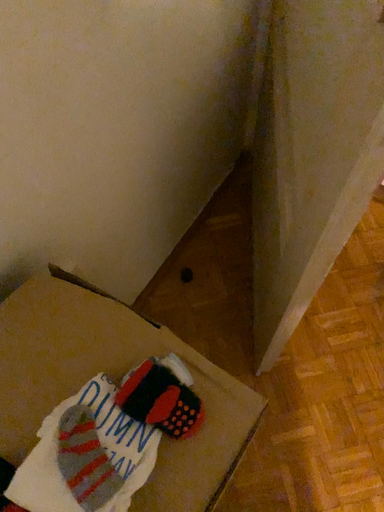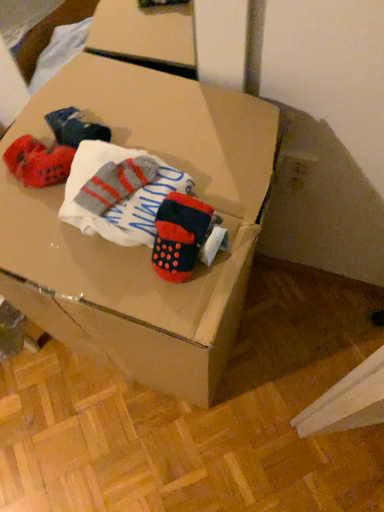
Question: How did the camera likely rotate when shooting the video?

Choices:
 (A) rotated upward
 (B) rotated downward

Answer: (A)